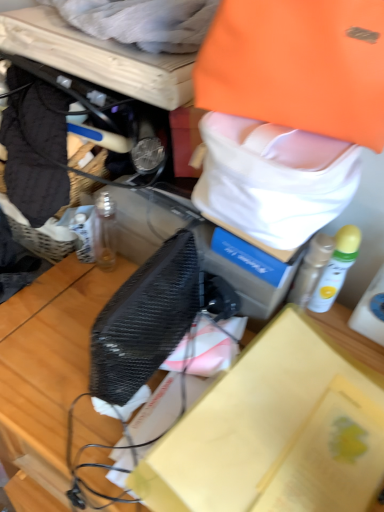
Question: Considering the relative sizes of white cotton towel at upper center, placed as the 1th clothing when sorted from top to bottom, and white matte spray can at right, the 2th bottle when ordered from left to right, in the image provided, is white cotton towel at upper center, placed as the 1th clothing when sorted from top to bottom, smaller than white matte spray can at right, the 2th bottle when ordered from left to right,?

Choices:
 (A) no
 (B) yes

Answer: (A)

Question: Does white cotton towel at upper center, placed as the 1th clothing when sorted from top to bottom, have a lesser height compared to white matte spray can at right, the 1th bottle in the right-to-left sequence?

Choices:
 (A) no
 (B) yes

Answer: (B)

Question: Is white cotton towel at upper center, which ranks as the 1th clothing in left-to-right order, looking in the opposite direction of white matte spray can at right, the 1th bottle in the right-to-left sequence?

Choices:
 (A) yes
 (B) no

Answer: (B)

Question: Does white cotton towel at upper center, which is counted as the 2th clothing, starting from the bottom, lie behind white matte spray can at right, the 1th bottle in the right-to-left sequence?

Choices:
 (A) yes
 (B) no

Answer: (B)

Question: From a real-world perspective, is white cotton towel at upper center, placed as the 1th clothing when sorted from top to bottom, located beneath white matte spray can at right, the 2th bottle when ordered from left to right?

Choices:
 (A) yes
 (B) no

Answer: (B)

Question: Are white cotton towel at upper center, placed as the second clothing when sorted from right to left, and white matte spray can at right, the 2th bottle when ordered from left to right, making contact?

Choices:
 (A) no
 (B) yes

Answer: (A)

Question: Is white matte spray can at right, the 2th bottle when ordered from left to right, far from white cotton towel at upper center, placed as the second clothing when sorted from right to left?

Choices:
 (A) no
 (B) yes

Answer: (A)

Question: From the image's perspective, is white matte spray can at right, the 1th bottle in the right-to-left sequence, under white cotton towel at upper center, which is counted as the 2th clothing, starting from the bottom?

Choices:
 (A) no
 (B) yes

Answer: (B)

Question: Does white matte spray can at right, the 1th bottle in the right-to-left sequence, appear on the right side of white cotton towel at upper center, which is counted as the 2th clothing, starting from the bottom?

Choices:
 (A) no
 (B) yes

Answer: (B)

Question: Considering the relative sizes of white matte spray can at right, the 1th bottle in the right-to-left sequence, and white cotton towel at upper center, placed as the second clothing when sorted from right to left, in the image provided, is white matte spray can at right, the 1th bottle in the right-to-left sequence, bigger than white cotton towel at upper center, placed as the second clothing when sorted from right to left,?

Choices:
 (A) yes
 (B) no

Answer: (B)

Question: Does white matte spray can at right, the 1th bottle in the right-to-left sequence, lie behind white cotton towel at upper center, which is counted as the 2th clothing, starting from the bottom?

Choices:
 (A) yes
 (B) no

Answer: (A)

Question: Is white matte spray can at right, the 1th bottle in the right-to-left sequence, thinner than white cotton towel at upper center, placed as the second clothing when sorted from right to left?

Choices:
 (A) no
 (B) yes

Answer: (B)

Question: Is orange fabric tote bag at upper right at the back of white matte spray can at right, the 1th bottle in the right-to-left sequence?

Choices:
 (A) no
 (B) yes

Answer: (A)